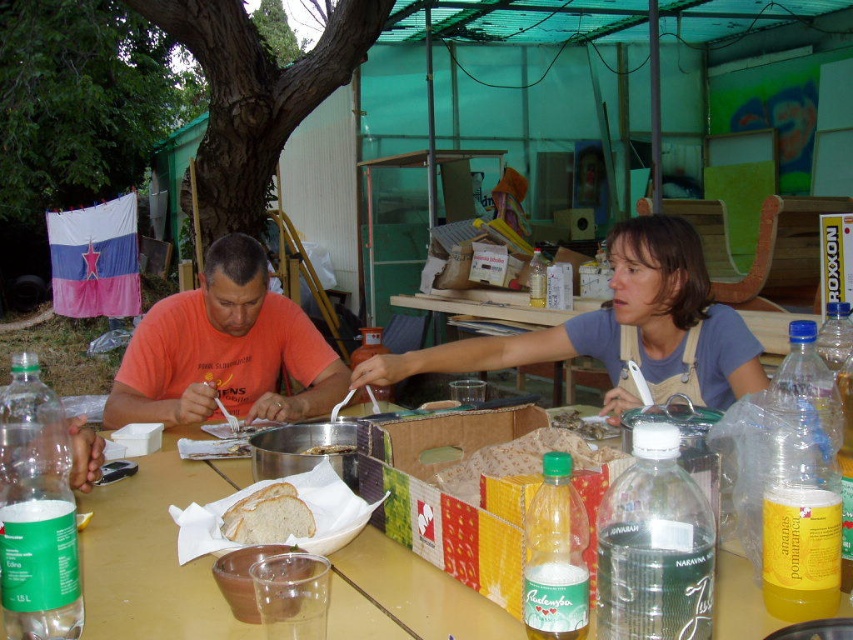
Which is below, blue fabric apron at upper center or white soft bread at center?

white soft bread at center is below.

Is blue fabric apron at upper center smaller than white soft bread at center?

Actually, blue fabric apron at upper center might be larger than white soft bread at center.

You are a GUI agent. You are given a task and a screenshot of the screen. Output one action in this format:
    pyautogui.click(x=<x>, y=<y>)
    Task: Click on the blue fabric apron at upper center
    Image resolution: width=853 pixels, height=640 pixels.
    Given the screenshot: What is the action you would take?
    pyautogui.click(x=622, y=328)

The image size is (853, 640). I want to click on blue fabric apron at upper center, so click(x=622, y=328).

Who is more distant from viewer, [646,376] or [303,316]?

Point [303,316]

Measure the distance from blue fabric apron at upper center to orange cotton shirt at left.

blue fabric apron at upper center is 65.07 centimeters from orange cotton shirt at left.

Identify the location of blue fabric apron at upper center. The height and width of the screenshot is (640, 853). (622, 328).

Locate an element on the screen. blue fabric apron at upper center is located at coordinates (622, 328).

Which of these two, yellow plastic table at center or white soft bread at center, stands shorter?

Standing shorter between the two is white soft bread at center.

Is point (189, 502) less distant than point (254, 504)?

No.

At what (x,y) coordinates should I click in order to perform the action: click on yellow plastic table at center. Please return your answer as a coordinate pair (x, y). The width and height of the screenshot is (853, 640). Looking at the image, I should click on (154, 554).